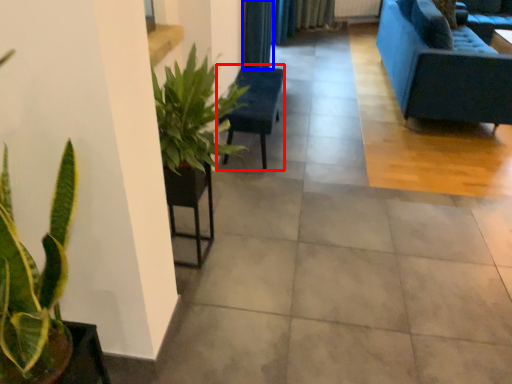
Question: Which point is further to the camera, armchair (highlighted by a red box) or curtain (highlighted by a blue box)?

Choices:
 (A) armchair
 (B) curtain

Answer: (B)